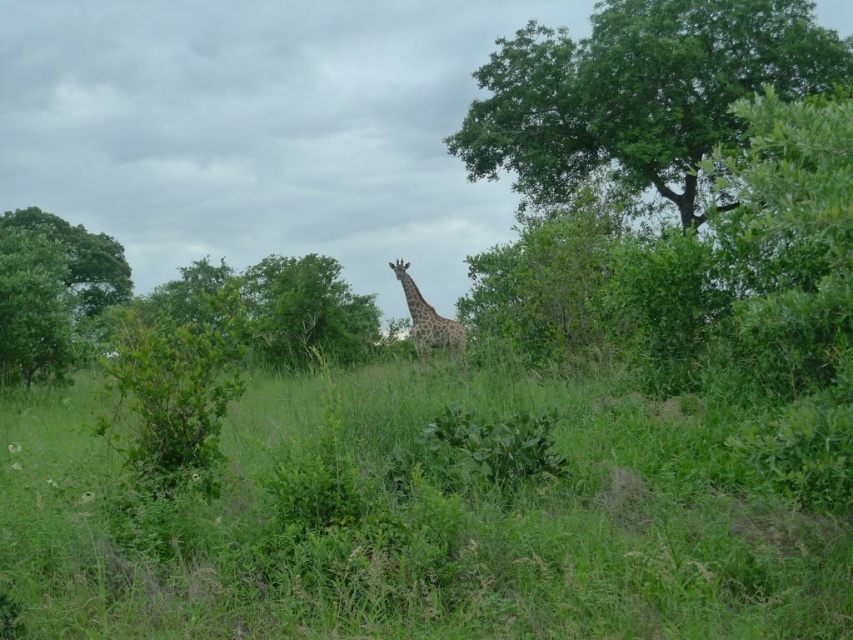
Question: Which of these objects is positioned farthest from the green leafy tree at upper right?

Choices:
 (A) spotted fur giraffe at center
 (B) green grassy at center
 (C) green leafy tree at center
 (D) green leafy tree at left

Answer: (B)

Question: Which object appears closest to the camera in this image?

Choices:
 (A) spotted fur giraffe at center
 (B) green grassy at center
 (C) green leafy tree at upper right

Answer: (B)

Question: Considering the relative positions of green leafy tree at upper right and green leafy tree at left in the image provided, where is green leafy tree at upper right located with respect to green leafy tree at left?

Choices:
 (A) left
 (B) right

Answer: (B)

Question: Does green leafy tree at center have a greater width compared to spotted fur giraffe at center?

Choices:
 (A) yes
 (B) no

Answer: (A)

Question: Which point is closer to the camera taking this photo?

Choices:
 (A) (9, 284)
 (B) (274, 364)

Answer: (A)

Question: Is green grassy at center to the right of spotted fur giraffe at center from the viewer's perspective?

Choices:
 (A) no
 (B) yes

Answer: (B)